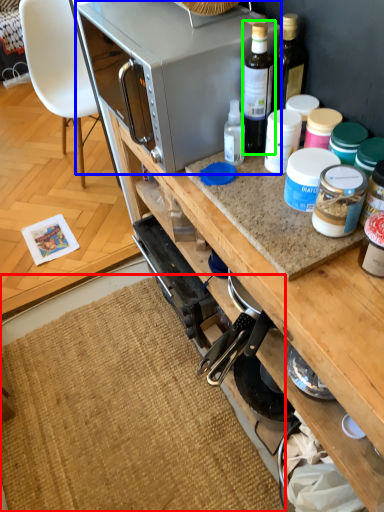
Question: Estimate the real-world distances between objects in this image. Which object is closer to mat (highlighted by a red box), microwave oven (highlighted by a blue box) or bottle (highlighted by a green box)?

Choices:
 (A) microwave oven
 (B) bottle

Answer: (A)